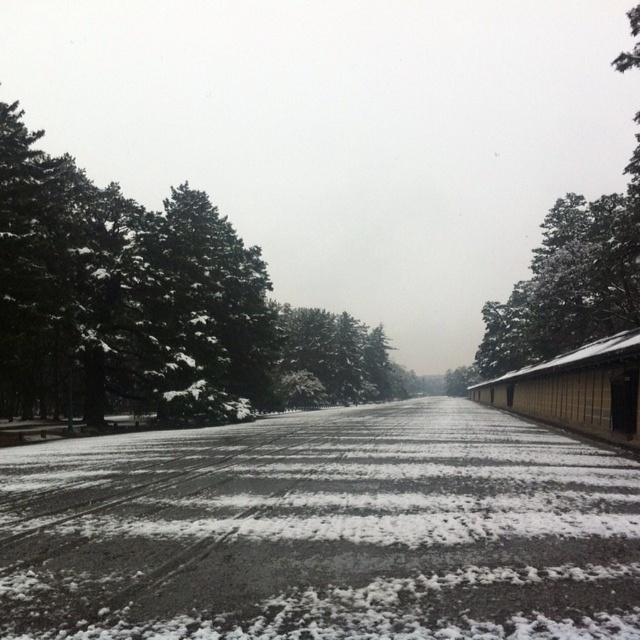
Question: Which object appears farthest from the camera in this image?

Choices:
 (A) white powdery snow at center
 (B) snow-covered evergreen at center
 (C) snow-covered tree at upper right

Answer: (B)

Question: Does white powdery snow at center have a larger size compared to snow-covered evergreen at center?

Choices:
 (A) yes
 (B) no

Answer: (B)

Question: Does white powdery snow at center have a greater width compared to snow-covered tree at upper right?

Choices:
 (A) yes
 (B) no

Answer: (B)

Question: Observing the image, what is the correct spatial positioning of white powdery snow at center in reference to snow-covered evergreen at center?

Choices:
 (A) above
 (B) below

Answer: (B)

Question: Which of the following is the closest to the observer?

Choices:
 (A) snow-covered tree at upper right
 (B) green snow-covered trees at left

Answer: (B)

Question: Which point is farther from the camera taking this photo?

Choices:
 (A) (134, 291)
 (B) (556, 627)
 (C) (330, 324)

Answer: (C)